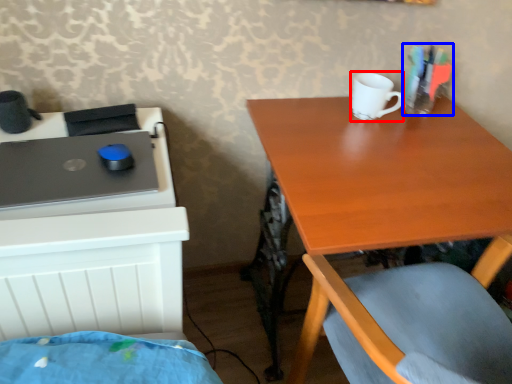
Question: Which object is closer to the camera taking this photo, mug (highlighted by a red box) or stationery (highlighted by a blue box)?

Choices:
 (A) mug
 (B) stationery

Answer: (A)